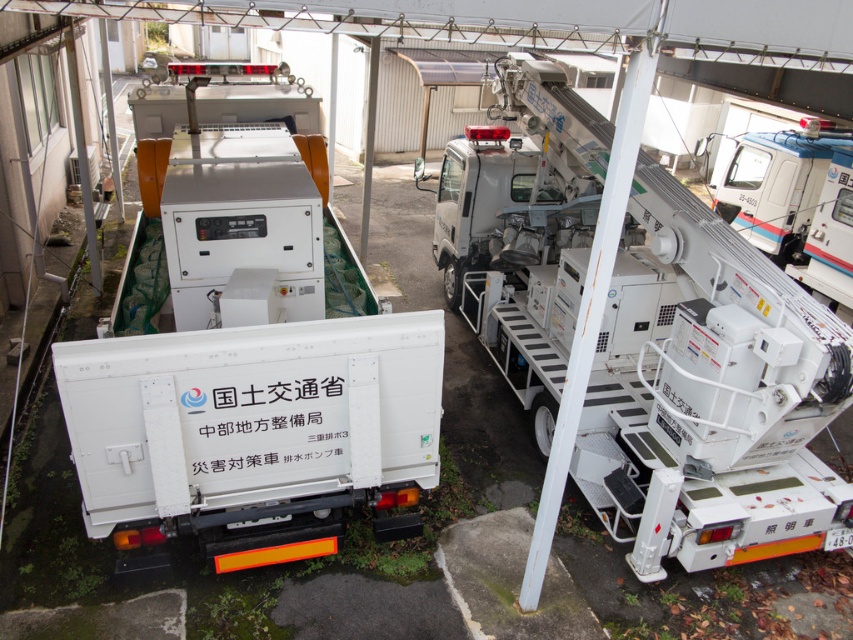
Does white metallic truck at right have a lesser height compared to white plastic truck at upper right?

Correct, white metallic truck at right is not as tall as white plastic truck at upper right.

Locate an element on the screen. white metallic truck at right is located at coordinates (712, 394).

Find the location of a particular element. The height and width of the screenshot is (640, 853). white metallic truck at right is located at coordinates coord(712,394).

Is white matte truck at center wider than white plastic truck at upper right?

Yes.

Is white matte truck at center to the right of white plastic truck at upper right from the viewer's perspective?

Incorrect, white matte truck at center is not on the right side of white plastic truck at upper right.

I want to click on white matte truck at center, so click(x=248, y=364).

Which of these two, white matte truck at center or white metallic truck at right, stands shorter?

white matte truck at center

Is point (306, 456) less distant than point (456, 260)?

Yes, point (306, 456) is closer to viewer.

Between point (329, 529) and point (786, 278), which one is positioned in front?

Point (329, 529) is more forward.

I want to click on white matte truck at center, so click(248, 364).